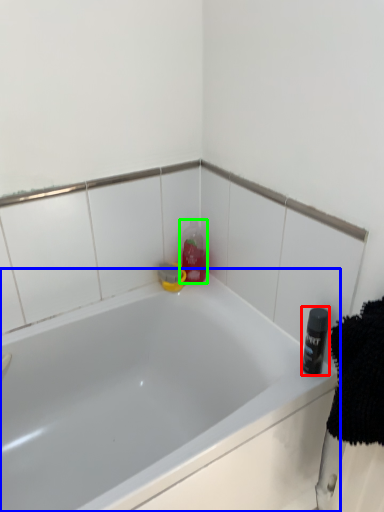
Question: Which object is positioned closest to toiletry (highlighted by a red box)? Select from bathtub (highlighted by a blue box) and cleaning product (highlighted by a green box).

Choices:
 (A) bathtub
 (B) cleaning product

Answer: (A)